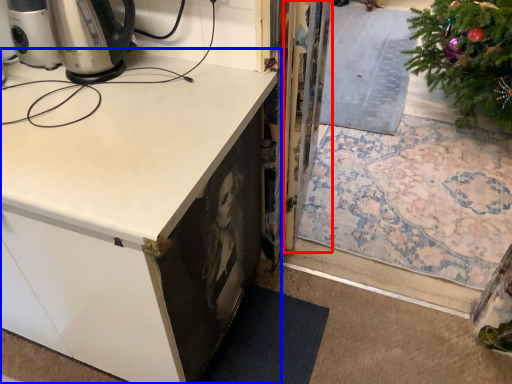
Question: Which point is closer to the camera, screen door (highlighted by a red box) or cabinetry (highlighted by a blue box)?

Choices:
 (A) screen door
 (B) cabinetry

Answer: (B)